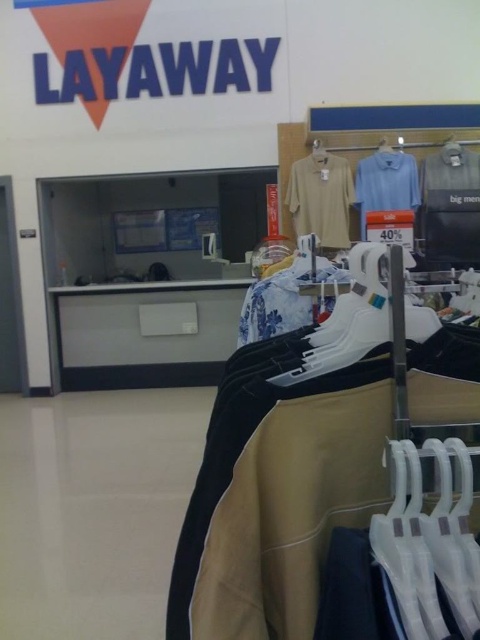
Is the position of white plastic hanger at center more distant than that of floral cotton shirt at center?

No, it is in front of floral cotton shirt at center.

Is white plastic hanger at center thinner than floral cotton shirt at center?

Correct, white plastic hanger at center's width is less than floral cotton shirt at center's.

Describe the element at coordinates (348, 321) in the screenshot. Image resolution: width=480 pixels, height=640 pixels. I see `white plastic hanger at center` at that location.

Find the location of a particular element. The width and height of the screenshot is (480, 640). white plastic hanger at center is located at coordinates (348, 321).

How much distance is there between white plastic hanger at center and white plastic hanger at upper center?

white plastic hanger at center and white plastic hanger at upper center are 3.82 meters apart.

Is white plastic hanger at center further to the viewer compared to white plastic hanger at upper center?

No, it is in front of white plastic hanger at upper center.

Is point (360, 314) positioned after point (319, 160)?

No, it is not.

Locate an element on the screen. The width and height of the screenshot is (480, 640). white plastic hanger at center is located at coordinates pyautogui.click(x=348, y=321).

Does beige fabric shirt at center have a lesser width compared to light blue cotton shirt at center?

In fact, beige fabric shirt at center might be wider than light blue cotton shirt at center.

Can you confirm if beige fabric shirt at center is wider than light blue cotton shirt at center?

Yes.

Between point (328, 170) and point (362, 234), which one is positioned behind?

Point (328, 170)

What are the coordinates of `beige fabric shirt at center` in the screenshot? It's located at (321, 198).